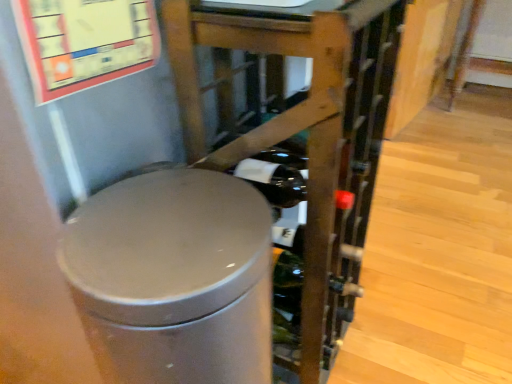
Find the location of a particular element. The image size is (512, 384). empty space that is ontop of satin silver trash can at center (from a real-world perspective) is located at coordinates point(163,232).